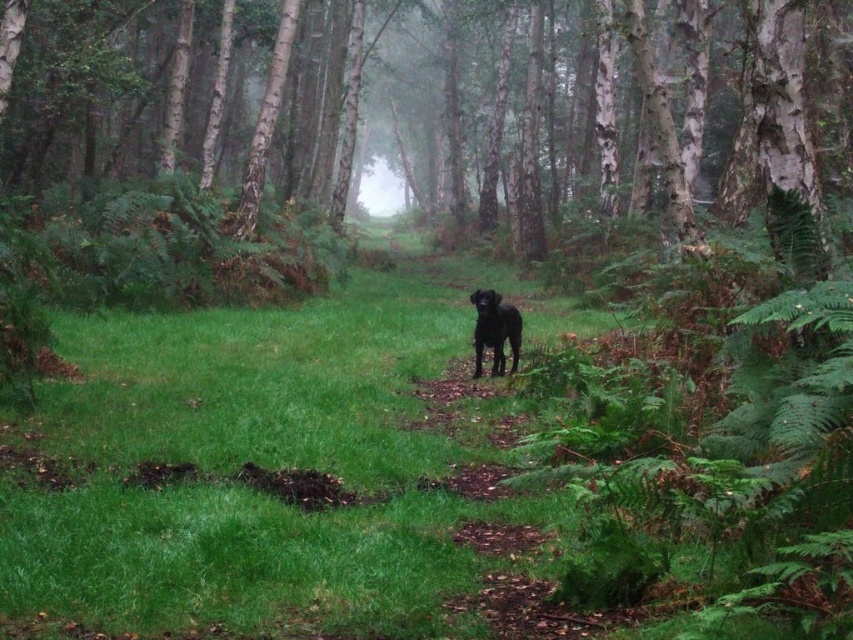
Can you confirm if green grass at center is positioned below smooth bark trees at center?

Yes.

Does green grass at center have a greater height compared to smooth bark trees at center?

No.

Is point (434, 291) behind point (178, 51)?

That is True.

Where is `green grass at center`? green grass at center is located at coordinates (270, 467).

Which is above, smooth bark trees at center or shiny black dog at center?

smooth bark trees at center is higher up.

I want to click on smooth bark trees at center, so click(547, 106).

In order to click on green grass at center in this screenshot , I will do `click(270, 467)`.

Which is behind, point (321, 449) or point (477, 374)?

Positioned behind is point (477, 374).

Does point (300, 344) come behind point (492, 321)?

Yes, it is behind point (492, 321).

Where is `green grass at center`? The image size is (853, 640). green grass at center is located at coordinates (270, 467).